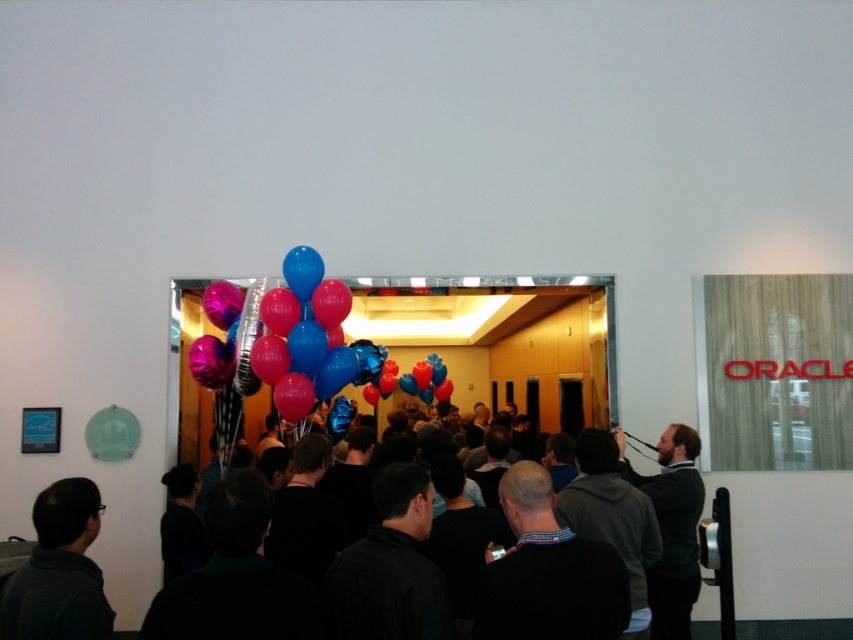
Does shiny metallic balloons at center appear on the left side of dark gray sweater at right?

Yes, shiny metallic balloons at center is to the left of dark gray sweater at right.

Can you confirm if shiny metallic balloons at center is wider than dark gray sweater at right?

Yes, shiny metallic balloons at center is wider than dark gray sweater at right.

Is point (223, 358) positioned before point (672, 461)?

No, it is behind (672, 461).

You are a GUI agent. You are given a task and a screenshot of the screen. Output one action in this format:
    pyautogui.click(x=<x>, y=<y>)
    Task: Click on the shiny metallic balloons at center
    
    Given the screenshot: What is the action you would take?
    pyautogui.click(x=281, y=337)

Between dark gray sweater at right and dark gray clothing at center, which one has less height?

Standing shorter between the two is dark gray clothing at center.

Find the location of a particular element. This screenshot has height=640, width=853. dark gray sweater at right is located at coordinates (671, 528).

Locate an element on the screen. The width and height of the screenshot is (853, 640). dark gray sweater at right is located at coordinates (671, 528).

Can you confirm if shiny metallic balloons at center is positioned to the left of dark gray clothing at center?

Correct, you'll find shiny metallic balloons at center to the left of dark gray clothing at center.

Can you confirm if shiny metallic balloons at center is smaller than dark gray clothing at center?

Incorrect, shiny metallic balloons at center is not smaller in size than dark gray clothing at center.

Where is `shiny metallic balloons at center`? This screenshot has width=853, height=640. shiny metallic balloons at center is located at coordinates click(x=281, y=337).

I want to click on shiny metallic balloons at center, so click(281, 337).